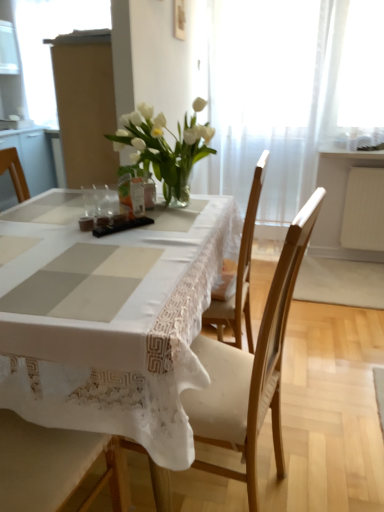
Question: Is wooden chair at center bigger than white glass vase at center?

Choices:
 (A) no
 (B) yes

Answer: (B)

Question: From a real-world perspective, is wooden chair at center located higher than white glass vase at center?

Choices:
 (A) yes
 (B) no

Answer: (B)

Question: Does wooden chair at center appear on the left side of white glass vase at center?

Choices:
 (A) yes
 (B) no

Answer: (B)

Question: Would you say wooden chair at center is a long distance from white glass vase at center?

Choices:
 (A) no
 (B) yes

Answer: (A)

Question: Does wooden chair at center touch white glass vase at center?

Choices:
 (A) no
 (B) yes

Answer: (A)

Question: Does wooden chair at center appear on the right side of white glass vase at center?

Choices:
 (A) yes
 (B) no

Answer: (A)

Question: From the image's perspective, would you say matte cardboard box at upper left is positioned over clear glass vase at center?

Choices:
 (A) yes
 (B) no

Answer: (A)

Question: From a real-world perspective, is matte cardboard box at upper left physically below clear glass vase at center?

Choices:
 (A) yes
 (B) no

Answer: (B)

Question: Can you confirm if matte cardboard box at upper left is shorter than clear glass vase at center?

Choices:
 (A) no
 (B) yes

Answer: (A)

Question: Is matte cardboard box at upper left looking in the opposite direction of clear glass vase at center?

Choices:
 (A) no
 (B) yes

Answer: (A)

Question: Is matte cardboard box at upper left next to clear glass vase at center?

Choices:
 (A) yes
 (B) no

Answer: (B)

Question: Can you confirm if matte cardboard box at upper left is wider than clear glass vase at center?

Choices:
 (A) no
 (B) yes

Answer: (B)

Question: From a real-world perspective, is white glass vase at center positioned under matte cardboard box at upper left based on gravity?

Choices:
 (A) yes
 (B) no

Answer: (A)